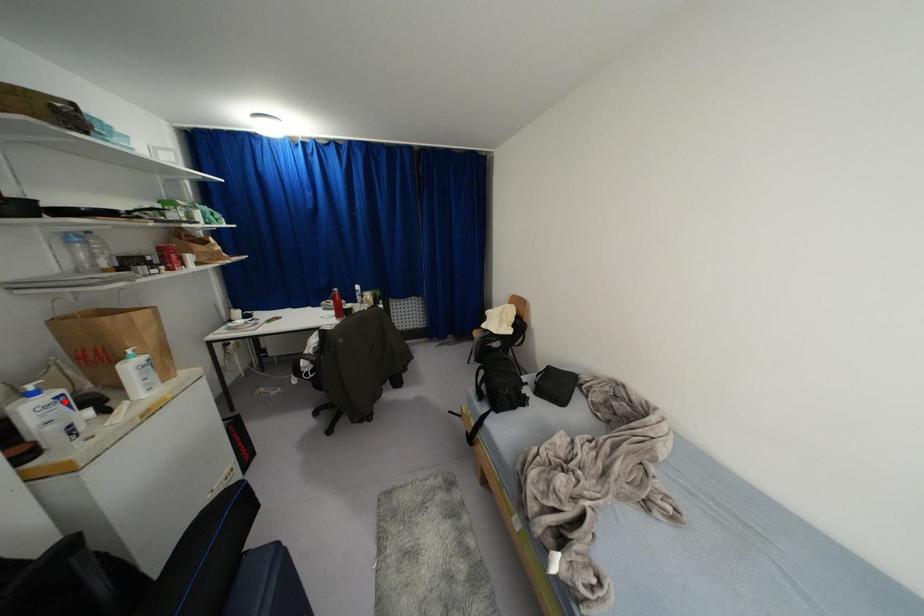
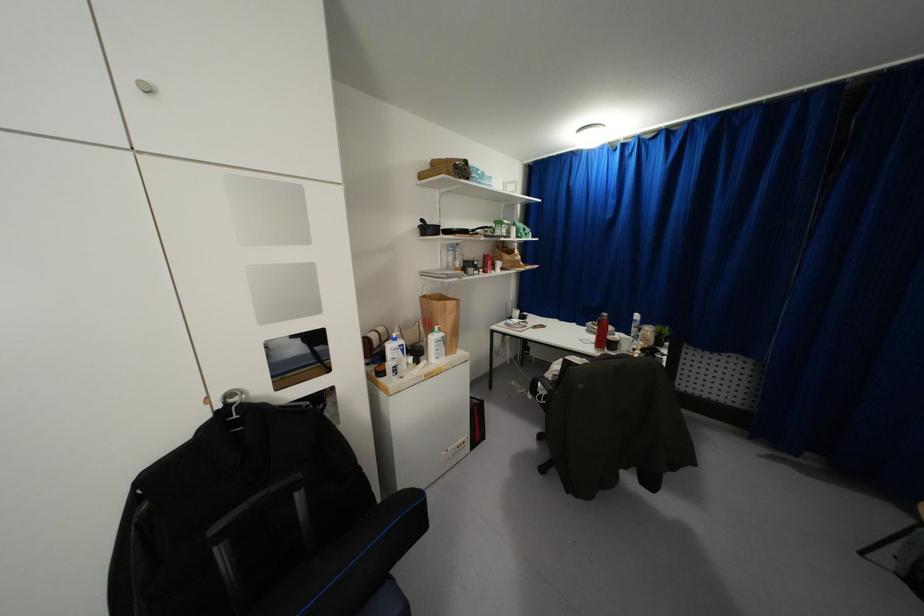
Locate, in the second image, the point that corresponds to the highlighted location in the first image.

(402, 350)